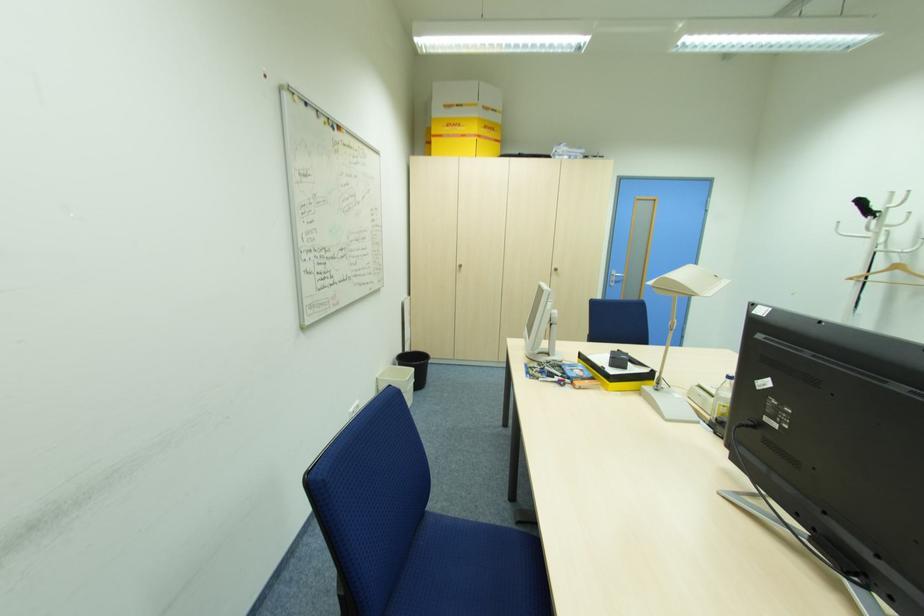
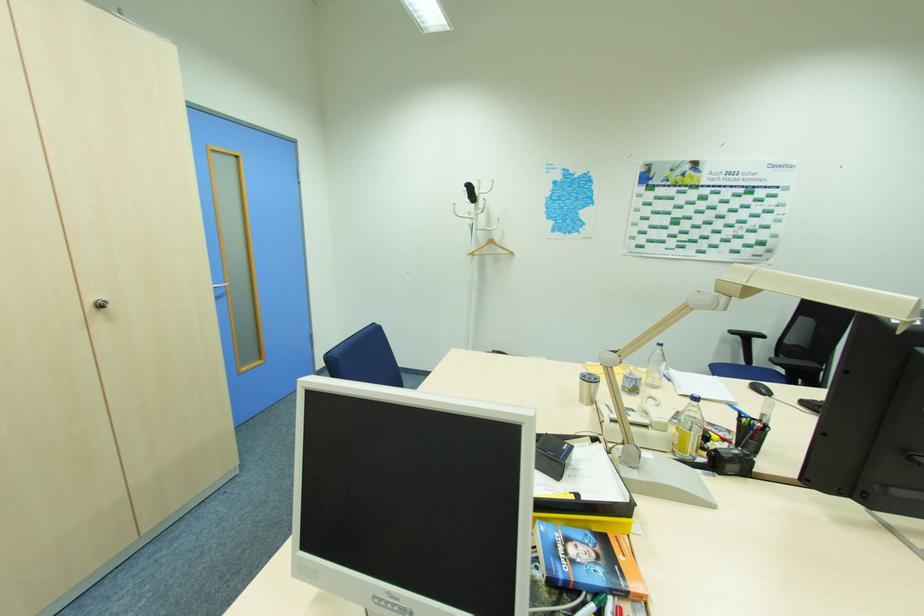
The point at (864, 203) is marked in the first image. Where is the corresponding point in the second image?

(472, 188)